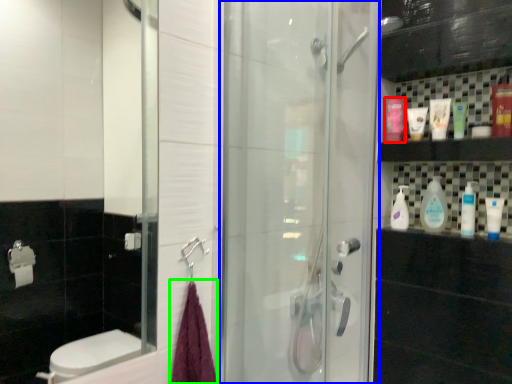
Question: Which object is positioned farthest from mouthwash (highlighted by a red box)? Select from screen door (highlighted by a blue box) and bath towel (highlighted by a green box).

Choices:
 (A) screen door
 (B) bath towel

Answer: (B)